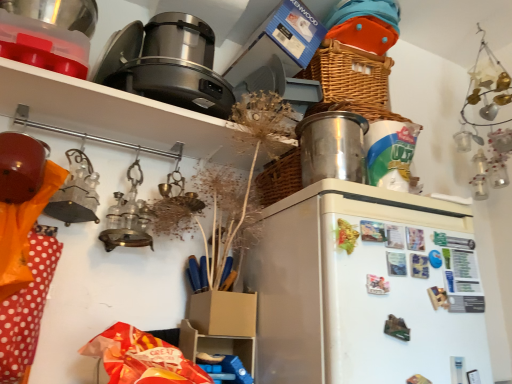
Question: Does matte black pot at upper left have a smaller size compared to shiny metallic container at upper right, the second appliance from the top?

Choices:
 (A) no
 (B) yes

Answer: (A)

Question: Is shiny metallic container at upper right, the 1th appliance ordered from the bottom, inside matte black pot at upper left?

Choices:
 (A) no
 (B) yes

Answer: (A)

Question: Is the depth of matte black pot at upper left greater than that of shiny metallic container at upper right, the second appliance from the top?

Choices:
 (A) yes
 (B) no

Answer: (B)

Question: Can you confirm if matte black pot at upper left is positioned to the right of shiny metallic container at upper right, which ranks as the 2th appliance in left-to-right order?

Choices:
 (A) no
 (B) yes

Answer: (A)

Question: Is matte black pot at upper left looking in the opposite direction of shiny metallic container at upper right, the second appliance from the top?

Choices:
 (A) no
 (B) yes

Answer: (A)

Question: Looking at their shapes, would you say white matte refrigerator at center is wider or thinner than satin silver appliance at upper center, marked as the 1th appliance in a top-to-bottom arrangement?

Choices:
 (A) wide
 (B) thin

Answer: (A)

Question: From a real-world perspective, is white matte refrigerator at center positioned above or below satin silver appliance at upper center, which appears as the second appliance when viewed from the right?

Choices:
 (A) above
 (B) below

Answer: (B)

Question: Considering the positions of point (367, 382) and point (111, 54), is point (367, 382) closer or farther from the camera than point (111, 54)?

Choices:
 (A) closer
 (B) farther

Answer: (A)

Question: Considering the positions of white matte refrigerator at center and satin silver appliance at upper center, positioned as the 2th appliance in bottom-to-top order, in the image, is white matte refrigerator at center taller or shorter than satin silver appliance at upper center, positioned as the 2th appliance in bottom-to-top order,?

Choices:
 (A) tall
 (B) short

Answer: (A)

Question: From a real-world perspective, is shiny metallic container at upper right, which ranks as the 2th appliance in left-to-right order, physically located above or below matte black pot at upper left?

Choices:
 (A) below
 (B) above

Answer: (A)

Question: Looking at the image, does shiny metallic container at upper right, the second appliance from the top, seem bigger or smaller compared to matte black pot at upper left?

Choices:
 (A) big
 (B) small

Answer: (B)

Question: Would you say shiny metallic container at upper right, the 1th appliance ordered from the bottom, is to the left or to the right of matte black pot at upper left in the picture?

Choices:
 (A) left
 (B) right

Answer: (B)

Question: Is shiny metallic container at upper right, which ranks as the 2th appliance in left-to-right order, in front of or behind matte black pot at upper left in the image?

Choices:
 (A) behind
 (B) front

Answer: (A)

Question: Considering the positions of point (155, 77) and point (99, 125), is point (155, 77) closer or farther from the camera than point (99, 125)?

Choices:
 (A) farther
 (B) closer

Answer: (B)

Question: Choose the correct answer: Is satin silver appliance at upper center, positioned as the 2th appliance in bottom-to-top order, inside matte black pot at upper left or outside it?

Choices:
 (A) inside
 (B) outside

Answer: (B)